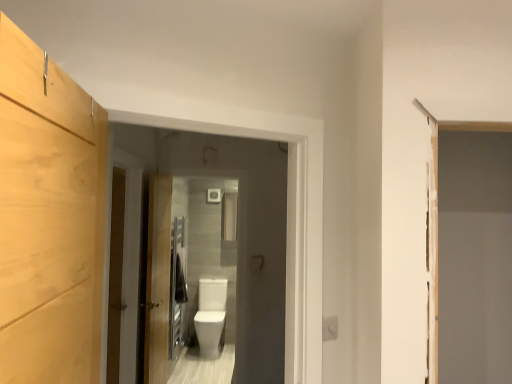
Question: Should I look upward or downward to see light wood cabinet at left?

Choices:
 (A) down
 (B) up

Answer: (A)

Question: Is light wood cabinet at left positioned far away from white glossy toilet bowl at center?

Choices:
 (A) yes
 (B) no

Answer: (A)

Question: Can you confirm if light wood cabinet at left is positioned to the left of white glossy toilet bowl at center?

Choices:
 (A) yes
 (B) no

Answer: (B)

Question: Is the surface of light wood cabinet at left in direct contact with white glossy toilet bowl at center?

Choices:
 (A) yes
 (B) no

Answer: (B)

Question: Is light wood cabinet at left outside of white glossy toilet bowl at center?

Choices:
 (A) yes
 (B) no

Answer: (A)

Question: From the image's perspective, is light wood cabinet at left on white glossy toilet bowl at center?

Choices:
 (A) no
 (B) yes

Answer: (B)

Question: Is light wood cabinet at left smaller than white glossy toilet bowl at center?

Choices:
 (A) yes
 (B) no

Answer: (A)

Question: Can you confirm if wooden barn door at left is bigger than white glossy toilet bowl at center?

Choices:
 (A) no
 (B) yes

Answer: (A)

Question: Is wooden barn door at left to the right of white glossy toilet bowl at center from the viewer's perspective?

Choices:
 (A) no
 (B) yes

Answer: (A)

Question: Is wooden barn door at left aimed at white glossy toilet bowl at center?

Choices:
 (A) no
 (B) yes

Answer: (A)

Question: Does wooden barn door at left come in front of white glossy toilet bowl at center?

Choices:
 (A) no
 (B) yes

Answer: (B)

Question: Is wooden barn door at left facing away from white glossy toilet bowl at center?

Choices:
 (A) yes
 (B) no

Answer: (B)

Question: From a real-world perspective, is wooden barn door at left under white glossy toilet bowl at center?

Choices:
 (A) no
 (B) yes

Answer: (A)

Question: Is wooden door at center, placed as the first door when sorted from left to right, located within wooden door at center, the second door viewed from the left?

Choices:
 (A) yes
 (B) no

Answer: (B)